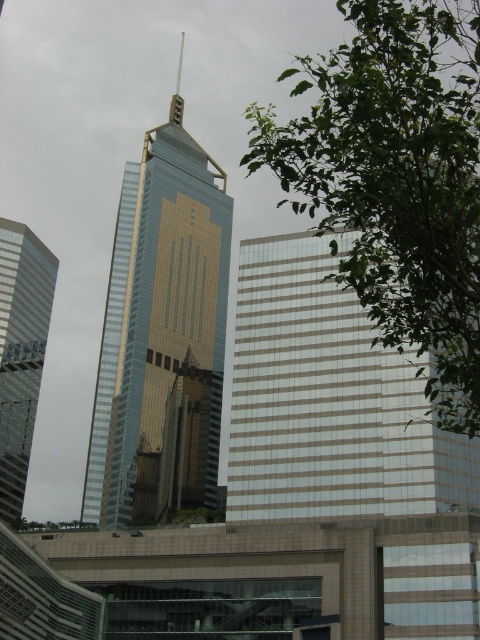
You are an architect analyzing the urban skyline. You notice the white glass building at center and the gold reflective glass tower at center. Based on their positions, which one is positioned lower in the image?

The white glass building at center is located below the gold reflective glass tower at center, so it is positioned lower in the image.

You are a drone operator planning to fly a drone between the gold reflective glass tower at center and the silver reflective glass skyscraper at left. The drone has a maximum flight height of 100 feet. Can the drone safely navigate between them without hitting either building?

The distance between the gold reflective glass tower at center and the silver reflective glass skyscraper at left is 110.00 feet. Since the drone can only fly up to 100 feet, it cannot safely navigate between them without hitting either building because the required height exceeds the drone s maximum flight capability.

You are an architect analyzing the urban layout. Which building takes up more area in the image, the white glass building at center or the silver reflective glass skyscraper at left?

The silver reflective glass skyscraper at left occupies more space than the white glass building at center according to the description.